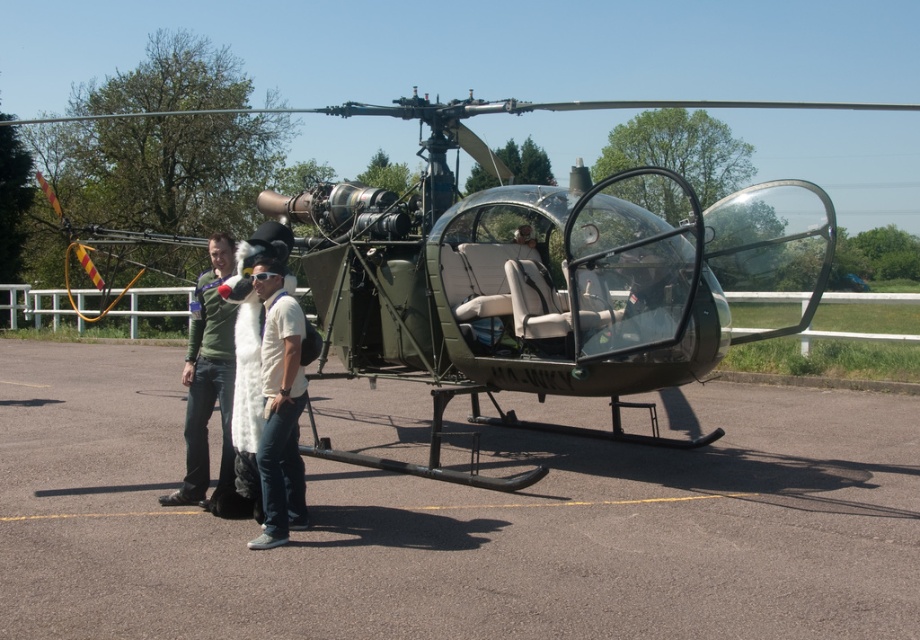
You are standing at the point labeled as point (269, 380) in the image. What object are you currently standing on?

You are standing on the white fur coat at center.

You are a photographer positioned behind the helicopter and want to capture both the gray asphalt tarmac at center and the white fur coat at center in your shot. Which object will appear larger in the photo?

The gray asphalt tarmac at center will appear larger in the photo because it is closer to the viewer than the white fur coat at center.

You are a photographer trying to capture the green matte helicopter at center and the white fur coat at center in the same frame. Based on their positions, which object should you adjust your camera to focus on first to ensure both are in the shot?

Since the green matte helicopter at center is to the right of the white fur coat at center, you should focus on the white fur coat at center first to ensure both are included in the frame.